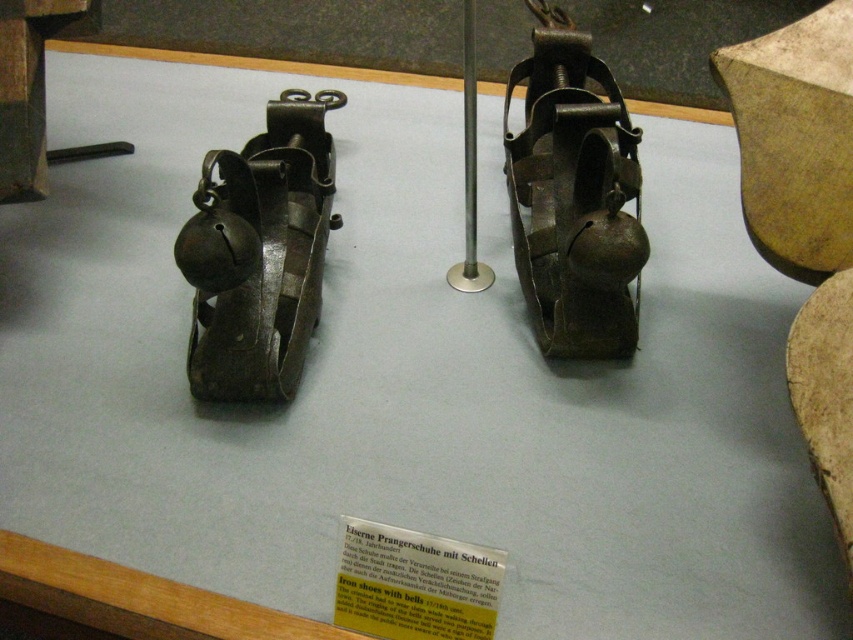
Question: Which point appears closest to the camera in this image?

Choices:
 (A) (572, 40)
 (B) (299, 202)

Answer: (B)

Question: In this image, where is matte metal iron shoe with bells at center located relative to dark brown leather shoe at center?

Choices:
 (A) below
 (B) above

Answer: (B)

Question: Which of the following is the farthest from the observer?

Choices:
 (A) dark brown leather shoe at center
 (B) matte metal iron shoe with bells at center

Answer: (B)

Question: Is matte metal iron shoe with bells at center wider than dark brown leather shoe at center?

Choices:
 (A) no
 (B) yes

Answer: (B)

Question: Does matte metal iron shoe with bells at center appear on the left side of dark brown leather shoe at center?

Choices:
 (A) yes
 (B) no

Answer: (B)